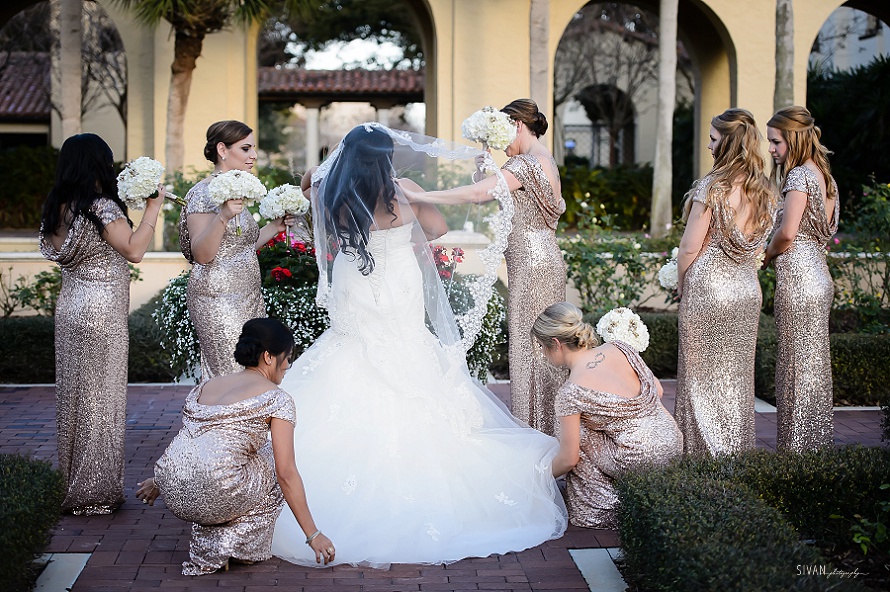
The height and width of the screenshot is (592, 890). I want to click on flower bouquets, so click(146, 175), click(240, 181), click(282, 193), click(492, 121), click(620, 330), click(670, 273).